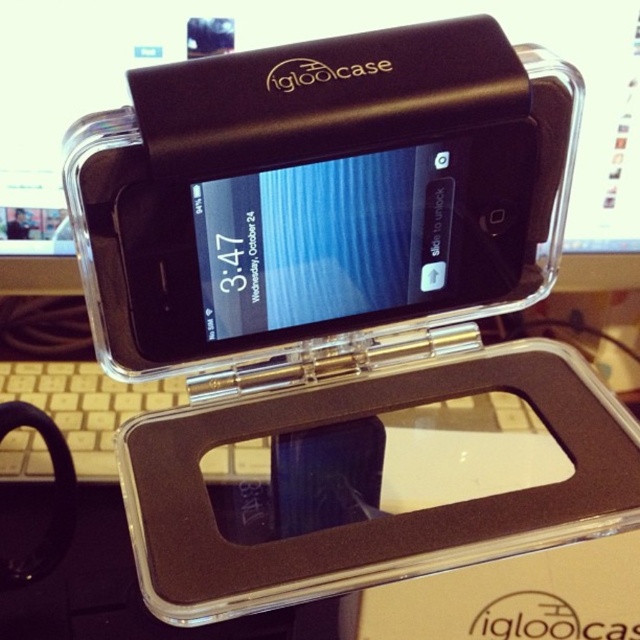
Can you confirm if transparent plastic computer monitor at center is positioned above beige plastic keyboard at lower left?

Correct, transparent plastic computer monitor at center is located above beige plastic keyboard at lower left.

Is transparent plastic computer monitor at center wider than beige plastic keyboard at lower left?

Yes, transparent plastic computer monitor at center is wider than beige plastic keyboard at lower left.

Is point (164, 60) behind point (68, 413)?

Yes, point (164, 60) is behind point (68, 413).

What are the coordinates of `transparent plastic computer monitor at center` in the screenshot? It's located at (284, 42).